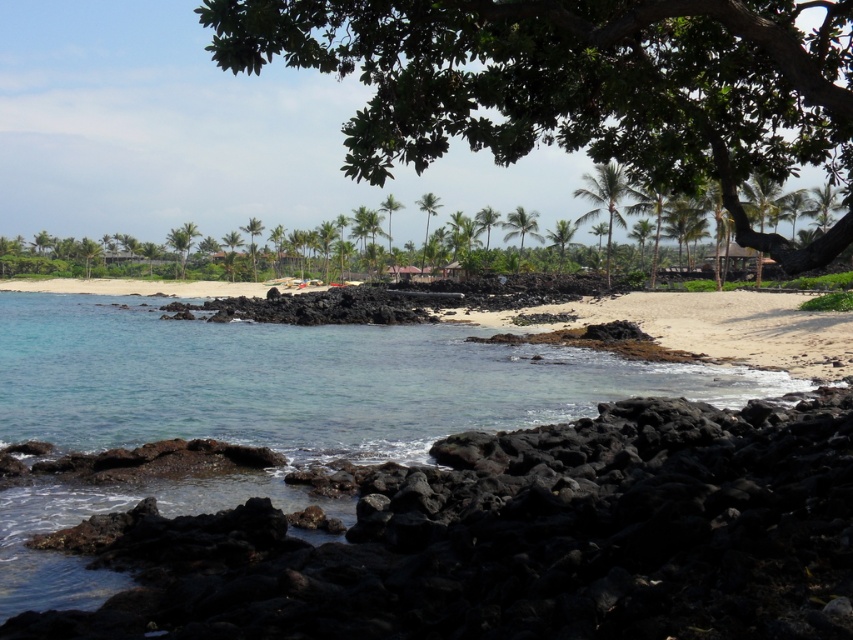
Question: Which of these objects is positioned farthest from the green leafy tree at upper center?

Choices:
 (A) green leafy palm tree at center
 (B) black volcanic rock at lower left
 (C) green leafy tree at center
 (D) white sandy beach at lower right

Answer: (C)

Question: Which object appears farthest from the camera in this image?

Choices:
 (A) green leafy palm tree at center
 (B) black volcanic rock at lower left
 (C) green leafy tree at center

Answer: (C)

Question: Considering the relative positions of white sandy beach at lower right and green leafy palm tree at center in the image provided, where is white sandy beach at lower right located with respect to green leafy palm tree at center?

Choices:
 (A) above
 (B) below

Answer: (B)

Question: Does green leafy tree at upper center appear on the left side of green leafy palm tree at center?

Choices:
 (A) no
 (B) yes

Answer: (B)

Question: Considering the relative positions of white sandy beach at lower right and green leafy palm tree at center in the image provided, where is white sandy beach at lower right located with respect to green leafy palm tree at center?

Choices:
 (A) below
 (B) above

Answer: (A)

Question: Among these points, which one is nearest to the camera?

Choices:
 (A) (303, 620)
 (B) (569, 221)

Answer: (A)